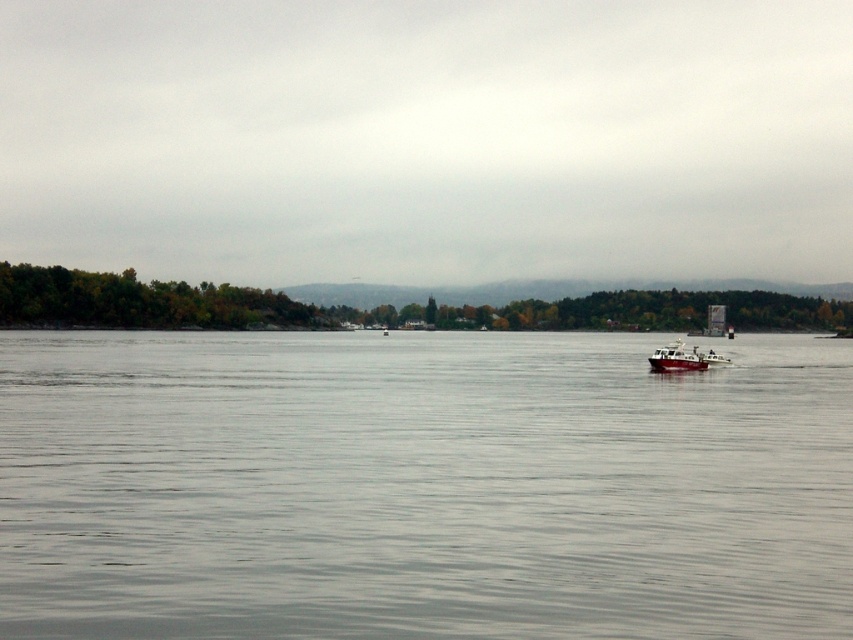
Looking at this image, you are a photographer planning to capture the red matte boat at center as it moves across the transparent water at center. Based on the scene, which object occupies a larger portion of the image in terms of width?

The transparent water at center is wider than the red matte boat at center according to the description.

You are a passenger on the red matte boat at center and want to see the transparent water at center. In which direction should you look from your current position?

The transparent water at center is positioned on the left side of the red matte boat at center, so you should look to your left to see the transparent water at center.

Consider the image. You are a photographer standing on the shore of the water scene. You want to capture the white plastic boat at right in your photo while ensuring it appears larger than the transparent water at center. Based on your current position, can you adjust your camera angle to achieve this?

The transparent water at center is taller than the white plastic boat at right, so if you move closer to the white plastic boat at right and zoom in, it will appear larger in the photo compared to the transparent water at center.